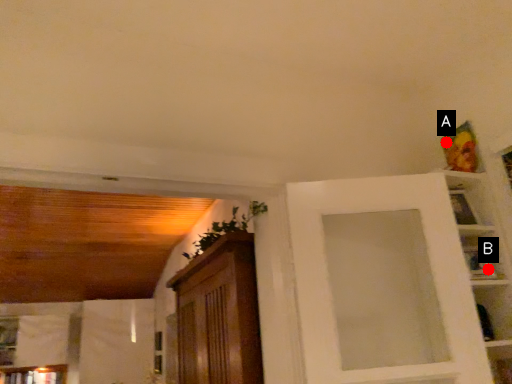
Question: Two points are circled on the image, labeled by A and B beside each circle. Which of the following is the farthest from the observer?

Choices:
 (A) A is further
 (B) B is further

Answer: (A)